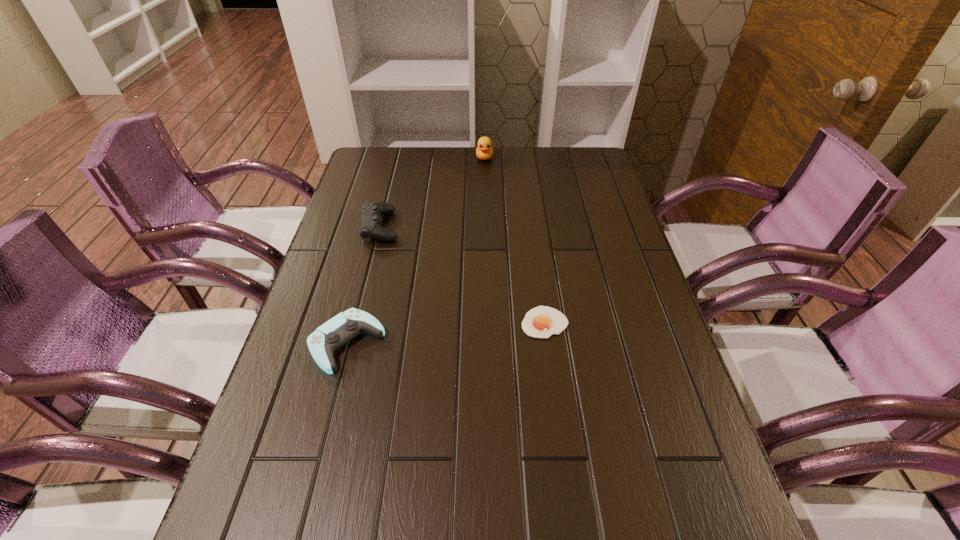
Find the location of `empty space between the rightmost object and the third object from left to right`. empty space between the rightmost object and the third object from left to right is located at coordinates (515, 240).

Find the location of `vacant point located between the shorter control and the shortest object`. vacant point located between the shorter control and the shortest object is located at coordinates (445, 333).

This screenshot has width=960, height=540. What are the coordinates of `empty space between the egg yolk and the nearer control` in the screenshot? It's located at (445, 333).

At what (x,y) coordinates should I click in order to perform the action: click on vacant region between the second farthest object and the shortest object. Please return your answer as a coordinate pair (x, y). This screenshot has width=960, height=540. Looking at the image, I should click on (463, 275).

What are the coordinates of `vacant area that lies between the shorter control and the taller control` in the screenshot? It's located at (363, 285).

The height and width of the screenshot is (540, 960). In order to click on free spot between the taller control and the shorter control in this screenshot , I will do coord(363,285).

Image resolution: width=960 pixels, height=540 pixels. Identify the location of vacant space in between the third tallest object and the farthest object. (416, 251).

Image resolution: width=960 pixels, height=540 pixels. What are the coordinates of `free space between the farthest object and the rightmost object` in the screenshot? It's located at (515, 240).

Identify which object is located as the nearest to the third tallest object. Please provide its 2D coordinates. Your answer should be formatted as a tuple, i.e. [(x, y)], where the tuple contains the x and y coordinates of a point satisfying the conditions above.

[(370, 220)]

The image size is (960, 540). In order to click on the second closest object relative to the rightmost object in this screenshot , I will do `click(370, 220)`.